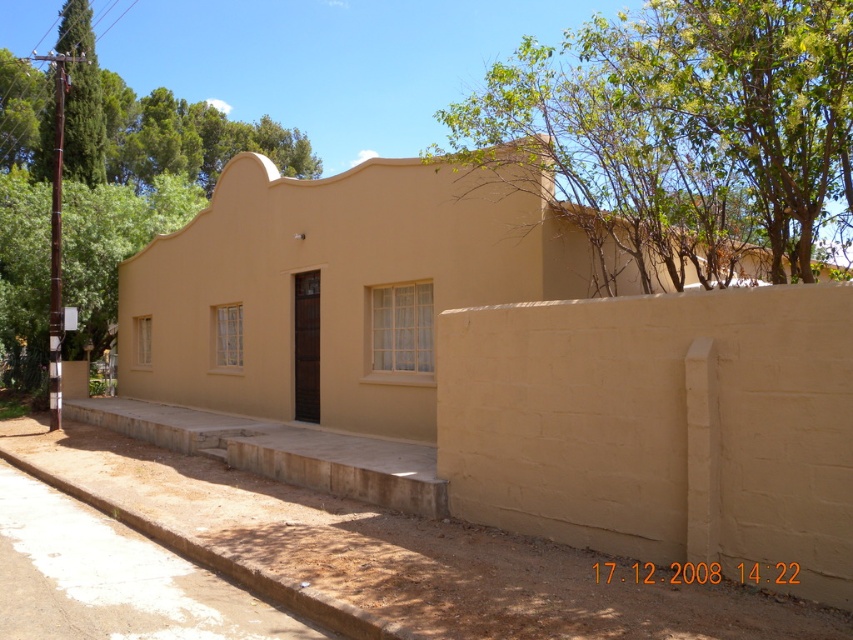
Is green leafy tree at upper left thinner than green textured tree at upper left?

Incorrect, green leafy tree at upper left's width is not less than green textured tree at upper left's.

Measure the distance between green leafy tree at upper left and camera.

green leafy tree at upper left is 18.53 meters away from camera.

Is point (108, 266) positioned behind point (80, 65)?

No, it is in front of (80, 65).

Where is `green leafy tree at upper left`? green leafy tree at upper left is located at coordinates (155, 129).

From the picture: Which of these two, green leafy tree at upper right or green textured tree at upper left, stands shorter?

green textured tree at upper left is shorter.

Does point (814, 214) come behind point (57, 40)?

No, (814, 214) is in front of (57, 40).

Locate an element on the screen. green leafy tree at upper right is located at coordinates (680, 129).

Is brown concrete curb at lower left taller than green textured tree at upper left?

No, brown concrete curb at lower left is not taller than green textured tree at upper left.

Which is more to the left, brown concrete curb at lower left or green textured tree at upper left?

green textured tree at upper left is more to the left.

The image size is (853, 640). What are the coordinates of `brown concrete curb at lower left` in the screenshot? It's located at (230, 564).